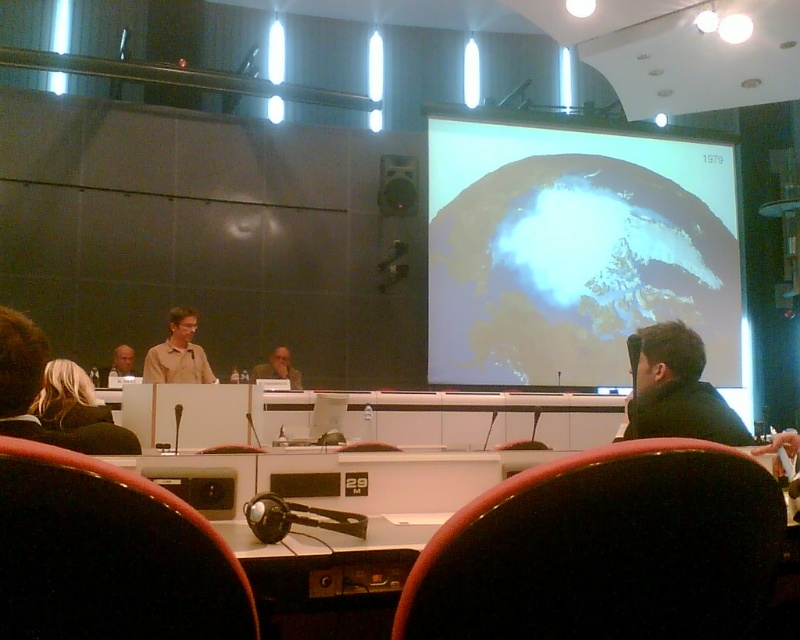
Is white matte projection screen at upper right further to the viewer compared to blonde hair at lower left?

Yes, it is behind blonde hair at lower left.

Measure the distance between white matte projection screen at upper right and blonde hair at lower left.

white matte projection screen at upper right is 21.93 feet away from blonde hair at lower left.

Is point (660, 282) farther from viewer compared to point (76, 404)?

Yes.

Locate an element on the screen. The width and height of the screenshot is (800, 640). white matte projection screen at upper right is located at coordinates (574, 252).

Describe the element at coordinates (574, 252) in the screenshot. This screenshot has width=800, height=640. I see `white matte projection screen at upper right` at that location.

What are the coordinates of `white matte projection screen at upper right` in the screenshot? It's located at (574, 252).

Is point (516, 202) positioned behind point (164, 376)?

That is True.

The image size is (800, 640). I want to click on white matte projection screen at upper right, so click(x=574, y=252).

Can you confirm if blonde hair at lower left is thinner than light brown leather jacket at lower left?

Incorrect, blonde hair at lower left's width is not less than light brown leather jacket at lower left's.

Between blonde hair at lower left and light brown leather jacket at lower left, which one has more height?

Standing taller between the two is light brown leather jacket at lower left.

Locate an element on the screen. This screenshot has width=800, height=640. blonde hair at lower left is located at coordinates click(68, 397).